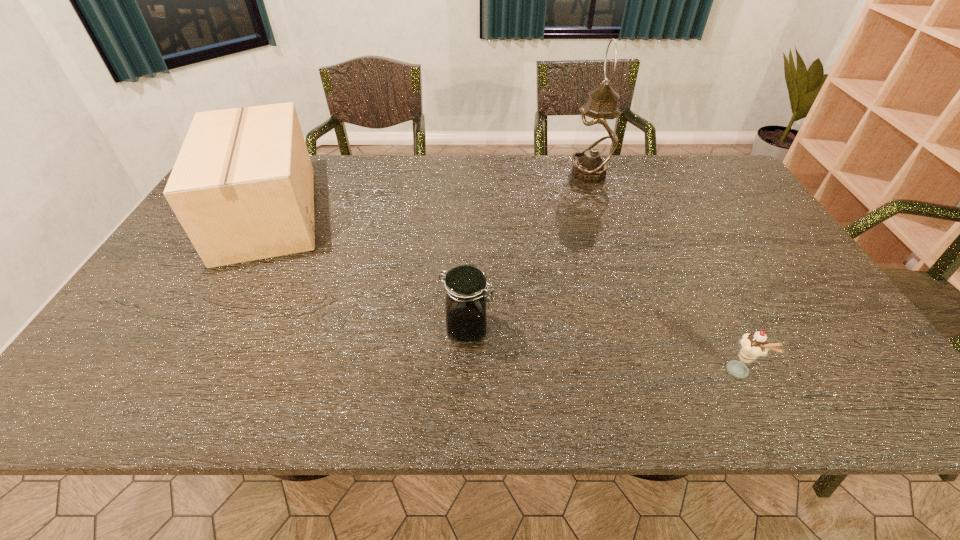
Where is `free space between the oil lamp and the icecream`? This screenshot has width=960, height=540. free space between the oil lamp and the icecream is located at coordinates (664, 273).

Identify the location of blank region between the icecream and the jar. This screenshot has height=540, width=960. (603, 350).

Locate an element on the screen. This screenshot has width=960, height=540. vacant area that lies between the third object from right to left and the tallest object is located at coordinates (528, 251).

At what (x,y) coordinates should I click in order to perform the action: click on vacant area between the icecream and the second tallest object. Please return your answer as a coordinate pair (x, y). Looking at the image, I should click on (503, 293).

Where is `unoccupied area between the oil lamp and the rightmost object`? unoccupied area between the oil lamp and the rightmost object is located at coordinates [x=664, y=273].

The image size is (960, 540). I want to click on empty location between the third shortest object and the second object from right to left, so click(x=428, y=194).

Where is `vacant area that lies between the third farthest object and the box`? vacant area that lies between the third farthest object and the box is located at coordinates (368, 271).

At what (x,y) coordinates should I click in order to perform the action: click on free area in between the third object from left to right and the second nearest object. Please return your answer as a coordinate pair (x, y). The image size is (960, 540). Looking at the image, I should click on (528, 251).

I want to click on blank region between the oil lamp and the icecream, so point(664,273).

Identify the location of empty space that is in between the nearest object and the third shortest object. The width and height of the screenshot is (960, 540). (503, 293).